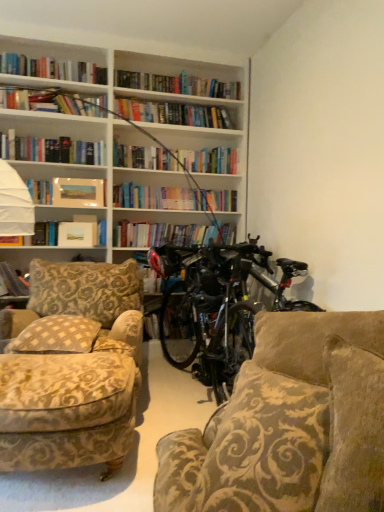
Question: Does matte paper photo frame at upper left, which is the 1th book in top-to-bottom order, appear on the left side of matte paper paperback book at upper left?

Choices:
 (A) no
 (B) yes

Answer: (A)

Question: From a real-world perspective, does matte paper photo frame at upper left, the 1th book when ordered from right to left, stand above matte paper paperback book at upper left?

Choices:
 (A) yes
 (B) no

Answer: (A)

Question: Does matte paper photo frame at upper left, the 2th book in the bottom-to-top sequence, turn towards matte paper paperback book at upper left?

Choices:
 (A) no
 (B) yes

Answer: (A)

Question: Is matte paper photo frame at upper left, placed as the 2th book when sorted from left to right, closer to the viewer compared to matte paper paperback book at upper left?

Choices:
 (A) no
 (B) yes

Answer: (B)

Question: Considering the relative sizes of matte paper photo frame at upper left, the 1th book when ordered from right to left, and matte paper paperback book at upper left in the image provided, is matte paper photo frame at upper left, the 1th book when ordered from right to left, taller than matte paper paperback book at upper left?

Choices:
 (A) yes
 (B) no

Answer: (A)

Question: Is beige checkered pillow at left taller or shorter than hardcover book at left, which appears as the 2th book when viewed from the right?

Choices:
 (A) tall
 (B) short

Answer: (B)

Question: Does point (59, 326) appear closer or farther from the camera than point (4, 279)?

Choices:
 (A) farther
 (B) closer

Answer: (B)

Question: Is beige checkered pillow at left situated inside hardcover book at left, which ranks as the 1th book in bottom-to-top order, or outside?

Choices:
 (A) outside
 (B) inside

Answer: (A)

Question: From a real-world perspective, relative to hardcover book at left, marked as the second book in a top-to-bottom arrangement, is beige checkered pillow at left vertically above or below?

Choices:
 (A) below
 (B) above

Answer: (A)

Question: Is point (112, 437) closer or farther from the camera than point (213, 364)?

Choices:
 (A) farther
 (B) closer

Answer: (B)

Question: From a real-world perspective, relative to shiny black bicycle at center, is velvet beige armchair at lower left vertically above or below?

Choices:
 (A) above
 (B) below

Answer: (B)

Question: In terms of width, does velvet beige armchair at lower left look wider or thinner when compared to shiny black bicycle at center?

Choices:
 (A) thin
 (B) wide

Answer: (B)

Question: Is velvet beige armchair at lower left in front of or behind shiny black bicycle at center in the image?

Choices:
 (A) front
 (B) behind

Answer: (A)

Question: Which is correct: shiny black bicycle at center is inside matte paper paperback book at upper left, or outside of it?

Choices:
 (A) inside
 (B) outside

Answer: (B)

Question: Considering the positions of shiny black bicycle at center and matte paper paperback book at upper left in the image, is shiny black bicycle at center bigger or smaller than matte paper paperback book at upper left?

Choices:
 (A) big
 (B) small

Answer: (A)